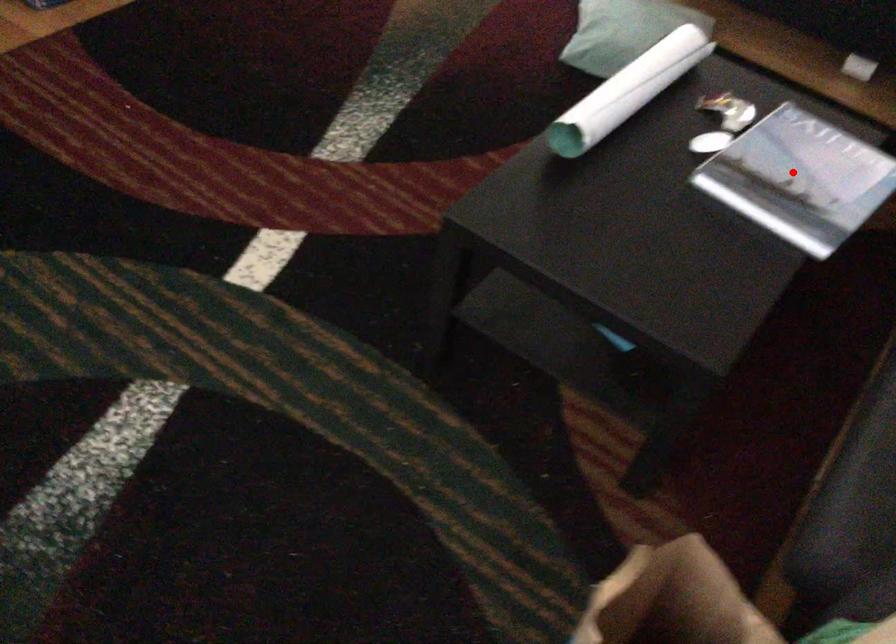
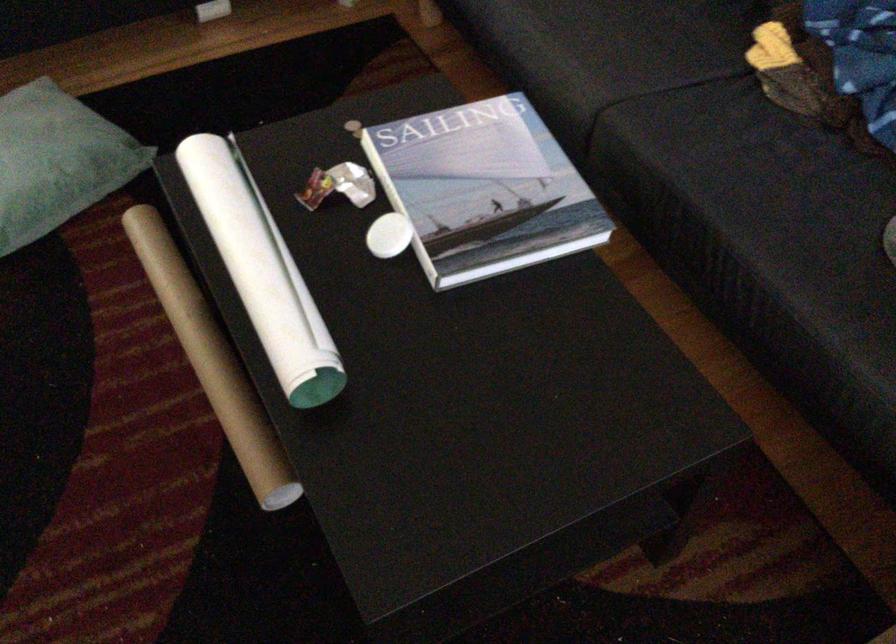
Question: I am providing you with two images of the same scene from different viewpoints. A red point is shown in image1. For the corresponding object point in image2, is it positioned nearer or farther from the camera?

Choices:
 (A) Nearer
 (B) Farther

Answer: (A)